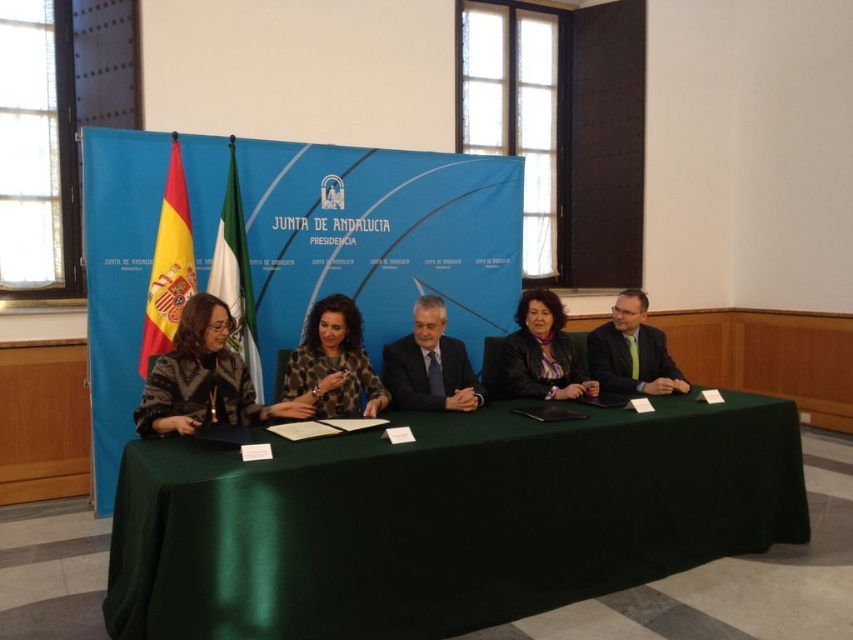
Is dark blue suit at center to the left of leather jacket at center from the viewer's perspective?

Yes, dark blue suit at center is to the left of leather jacket at center.

Is point (418, 365) closer to viewer compared to point (563, 356)?

Yes, point (418, 365) is in front of point (563, 356).

Identify the location of dark blue suit at center. (428, 364).

Can you confirm if patterned fabric jacket at left is thinner than leopard print jacket at center?

Result: No.

Is patterned fabric jacket at left wider than leopard print jacket at center?

Yes.

This screenshot has height=640, width=853. What do you see at coordinates (202, 378) in the screenshot?
I see `patterned fabric jacket at left` at bounding box center [202, 378].

Where is `patterned fabric jacket at left`? The image size is (853, 640). patterned fabric jacket at left is located at coordinates (202, 378).

Who is shorter, leopard print jacket at center or green fabric flag at left?

Standing shorter between the two is leopard print jacket at center.

Find the location of `leopard print jacket at center`. leopard print jacket at center is located at coordinates (334, 364).